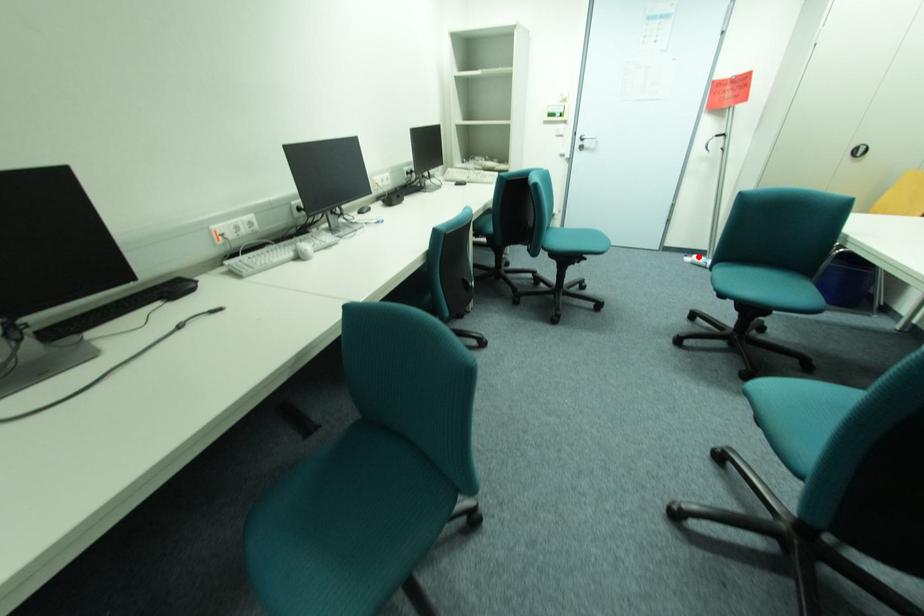
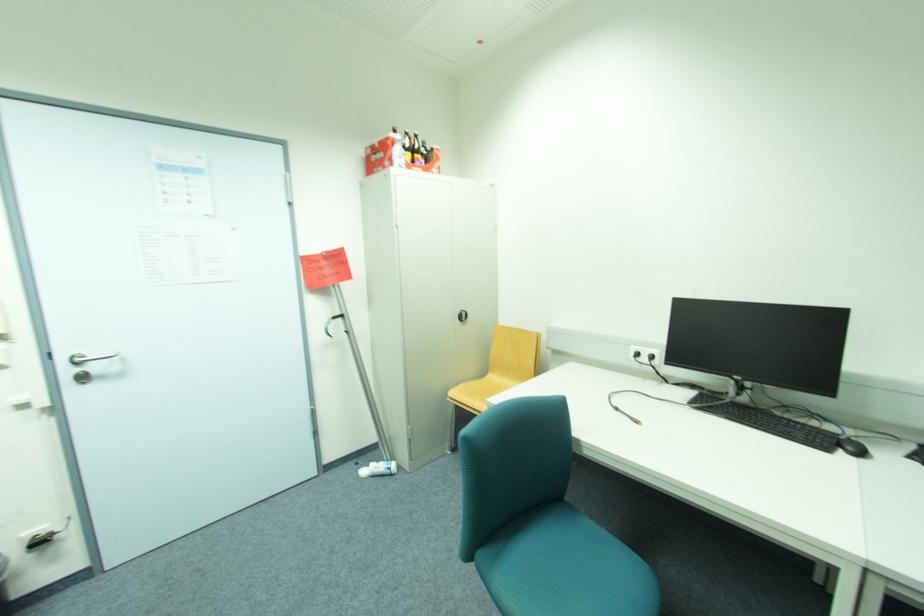
Find the pixel in the second image that matches the highlighted location in the first image.

(373, 468)